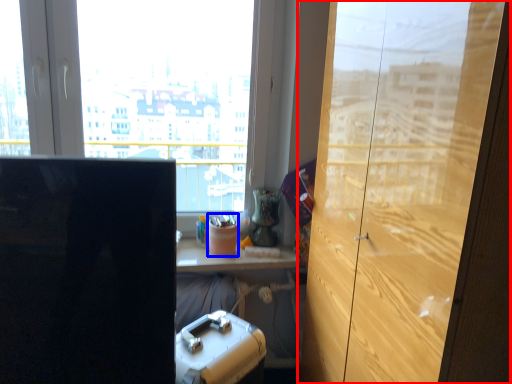
Question: Which object appears farthest to the camera in this image, cupboard (highlighted by a red box) or stationery (highlighted by a blue box)?

Choices:
 (A) cupboard
 (B) stationery

Answer: (B)